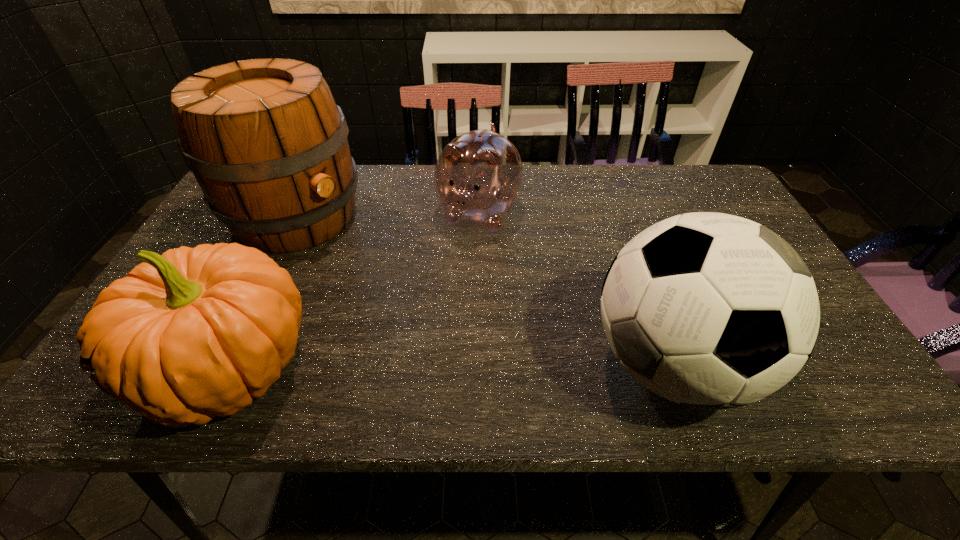
In the image, there is a desktop. Where is `vacant region at the far edge`? Image resolution: width=960 pixels, height=540 pixels. vacant region at the far edge is located at coordinates (414, 196).

This screenshot has width=960, height=540. I want to click on free location at the near edge, so click(x=550, y=340).

You are a GUI agent. You are given a task and a screenshot of the screen. Output one action in this format:
    pyautogui.click(x=<x>, y=<y>)
    Task: Click on the free space at the far right corner of the desktop
    The image size is (960, 540).
    Given the screenshot: What is the action you would take?
    pyautogui.click(x=714, y=197)

This screenshot has height=540, width=960. In order to click on vacant area between the second object from right to left and the pumpkin in this screenshot , I will do `click(353, 292)`.

Where is `vacant point located between the cider and the third object from left to right`? This screenshot has height=540, width=960. vacant point located between the cider and the third object from left to right is located at coordinates (388, 214).

This screenshot has width=960, height=540. Find the location of `vacant area between the pumpkin and the second object from right to left`. vacant area between the pumpkin and the second object from right to left is located at coordinates (353, 292).

Image resolution: width=960 pixels, height=540 pixels. I want to click on free spot between the pumpkin and the shortest object, so click(353, 292).

Find the location of a particular element. The image size is (960, 540). unoccupied area between the pumpkin and the second object from right to left is located at coordinates (353, 292).

Where is `free space between the pumpkin and the soccer ball`? This screenshot has height=540, width=960. free space between the pumpkin and the soccer ball is located at coordinates (450, 368).

In order to click on free space that is in between the third object from left to right and the pumpkin in this screenshot , I will do `click(353, 292)`.